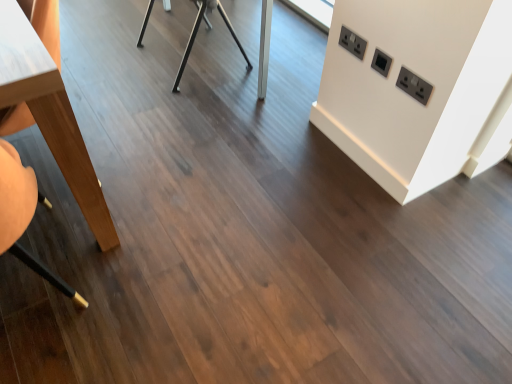
Question: Does black plastic electric outlet at upper right, which is the 3th electric outlet from top to bottom, have a lesser height compared to black plastic electric outlet at upper right, the 2th electric outlet ordered from the bottom?

Choices:
 (A) yes
 (B) no

Answer: (B)

Question: Is black plastic electric outlet at upper right, positioned as the 1th electric outlet in right-to-left order, behind black plastic electric outlet at upper right, the 2th electric outlet ordered from the bottom?

Choices:
 (A) yes
 (B) no

Answer: (B)

Question: Can you confirm if black plastic electric outlet at upper right, which ranks as the first electric outlet in bottom-to-top order, is taller than black plastic electric outlet at upper right, the 2th electric outlet from the right?

Choices:
 (A) yes
 (B) no

Answer: (A)

Question: Is black plastic electric outlet at upper right, which is the 3th electric outlet from top to bottom, to the left of black plastic electric outlet at upper right, which is counted as the 2th electric outlet, starting from the top, from the viewer's perspective?

Choices:
 (A) yes
 (B) no

Answer: (B)

Question: Considering the relative sizes of black plastic electric outlet at upper right, marked as the 3th electric outlet in a left-to-right arrangement, and black plastic electric outlet at upper right, arranged as the 2th electric outlet when viewed from the left, in the image provided, is black plastic electric outlet at upper right, marked as the 3th electric outlet in a left-to-right arrangement, smaller than black plastic electric outlet at upper right, arranged as the 2th electric outlet when viewed from the left,?

Choices:
 (A) yes
 (B) no

Answer: (B)

Question: From a real-world perspective, is black plastic electric outlet at upper right, which is counted as the 2th electric outlet, starting from the top, above or below wooden swivel chair at left?

Choices:
 (A) above
 (B) below

Answer: (A)

Question: Is black plastic electric outlet at upper right, the 2th electric outlet from the right, inside the boundaries of wooden swivel chair at left, or outside?

Choices:
 (A) outside
 (B) inside

Answer: (A)

Question: Considering the positions of point (377, 57) and point (25, 213), is point (377, 57) closer or farther from the camera than point (25, 213)?

Choices:
 (A) closer
 (B) farther

Answer: (B)

Question: From their relative heights in the image, would you say black plastic electric outlet at upper right, the 2th electric outlet from the right, is taller or shorter than wooden swivel chair at left?

Choices:
 (A) short
 (B) tall

Answer: (A)

Question: Based on their sizes in the image, would you say black plastic electric outlet at upper right, the 2th electric outlet ordered from the bottom, is bigger or smaller than black plastic electric outlet at upper right, which ranks as the first electric outlet in bottom-to-top order?

Choices:
 (A) small
 (B) big

Answer: (A)

Question: Choose the correct answer: Is black plastic electric outlet at upper right, arranged as the 2th electric outlet when viewed from the left, inside black plastic electric outlet at upper right, marked as the 3th electric outlet in a left-to-right arrangement, or outside it?

Choices:
 (A) inside
 (B) outside

Answer: (B)

Question: From their relative heights in the image, would you say black plastic electric outlet at upper right, the 2th electric outlet ordered from the bottom, is taller or shorter than black plastic electric outlet at upper right, positioned as the 1th electric outlet in right-to-left order?

Choices:
 (A) short
 (B) tall

Answer: (A)

Question: Is point (376, 57) positioned closer to the camera than point (401, 74)?

Choices:
 (A) farther
 (B) closer

Answer: (A)

Question: From the image's perspective, relative to wooden swivel chair at left, is black plastic/socket at upper right, which ranks as the first electric outlet in top-to-bottom order, above or below?

Choices:
 (A) above
 (B) below

Answer: (A)

Question: Is black plastic/socket at upper right, which is the 1th electric outlet in left-to-right order, wider or thinner than wooden swivel chair at left?

Choices:
 (A) thin
 (B) wide

Answer: (A)